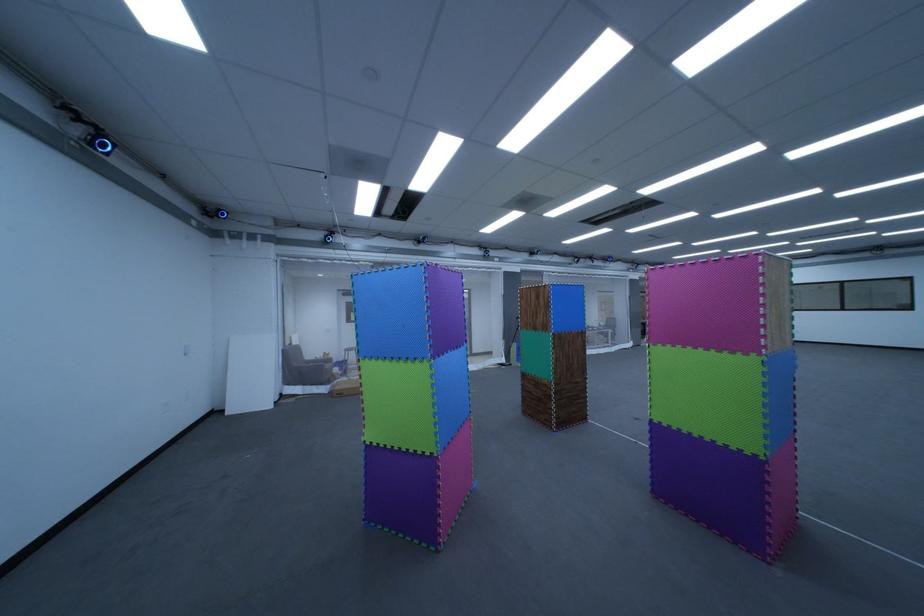
Where is `gray chair sitting surface`? The image size is (924, 616). gray chair sitting surface is located at coordinates (332, 363).